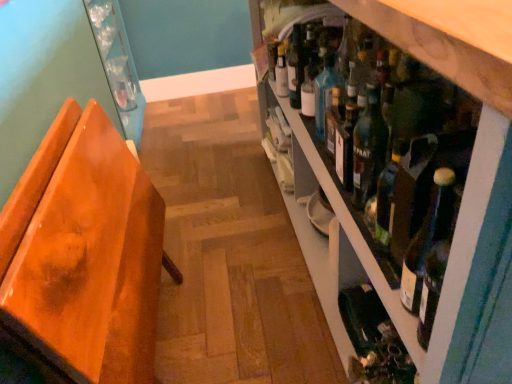
Question: From the image's perspective, does orange wood chair at left appear lower than green glass bottle at lower right?

Choices:
 (A) yes
 (B) no

Answer: (B)

Question: Is orange wood chair at left not near green glass bottle at lower right?

Choices:
 (A) yes
 (B) no

Answer: (B)

Question: Considering the relative sizes of orange wood chair at left and green glass bottle at lower right in the image provided, is orange wood chair at left wider than green glass bottle at lower right?

Choices:
 (A) yes
 (B) no

Answer: (B)

Question: Is orange wood chair at left positioned before green glass bottle at lower right?

Choices:
 (A) yes
 (B) no

Answer: (A)

Question: Is orange wood chair at left not within green glass bottle at lower right?

Choices:
 (A) no
 (B) yes

Answer: (B)

Question: Considering the positions of green glass bottle at lower right and green glass bottles at right in the image, is green glass bottle at lower right wider or thinner than green glass bottles at right?

Choices:
 (A) wide
 (B) thin

Answer: (B)

Question: From the image's perspective, is green glass bottle at lower right positioned above or below green glass bottles at right?

Choices:
 (A) below
 (B) above

Answer: (A)

Question: From their relative heights in the image, would you say green glass bottle at lower right is taller or shorter than green glass bottles at right?

Choices:
 (A) tall
 (B) short

Answer: (B)

Question: Choose the correct answer: Is green glass bottle at lower right inside green glass bottles at right or outside it?

Choices:
 (A) outside
 (B) inside

Answer: (B)

Question: Is green glass bottle at lower right in front of or behind green glass bottle at center right in the image?

Choices:
 (A) behind
 (B) front

Answer: (A)

Question: Is green glass bottle at lower right inside the boundaries of green glass bottle at center right, or outside?

Choices:
 (A) inside
 (B) outside

Answer: (B)

Question: In terms of height, does green glass bottle at lower right look taller or shorter compared to green glass bottle at center right?

Choices:
 (A) short
 (B) tall

Answer: (A)

Question: From a real-world perspective, relative to green glass bottle at center right, is green glass bottle at lower right vertically above or below?

Choices:
 (A) above
 (B) below

Answer: (B)

Question: Would you say white glass bottle at upper center is inside or outside orange wood chair at left?

Choices:
 (A) outside
 (B) inside

Answer: (A)

Question: Is point (282, 89) positioned closer to the camera than point (13, 248)?

Choices:
 (A) farther
 (B) closer

Answer: (A)